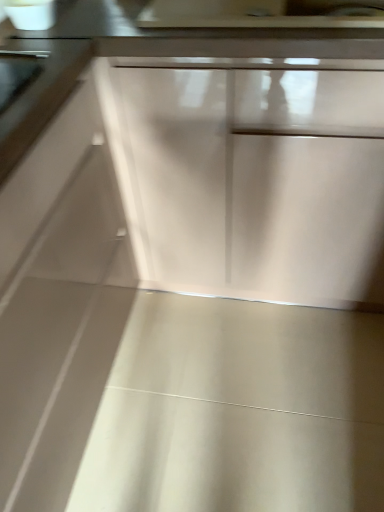
Question: Is satin silver handle at upper left completely or partially outside of matte white drawer at center?

Choices:
 (A) no
 (B) yes

Answer: (B)

Question: Considering the relative sizes of satin silver handle at upper left and matte white drawer at center in the image provided, is satin silver handle at upper left wider than matte white drawer at center?

Choices:
 (A) yes
 (B) no

Answer: (B)

Question: Does satin silver handle at upper left have a greater height compared to matte white drawer at center?

Choices:
 (A) yes
 (B) no

Answer: (B)

Question: Does satin silver handle at upper left touch matte white drawer at center?

Choices:
 (A) yes
 (B) no

Answer: (B)

Question: Is satin silver handle at upper left looking in the opposite direction of matte white drawer at center?

Choices:
 (A) yes
 (B) no

Answer: (B)

Question: Are satin silver handle at upper left and matte white drawer at center located far from each other?

Choices:
 (A) yes
 (B) no

Answer: (B)

Question: Can you confirm if matte white drawer at center is positioned to the left of satin silver handle at upper left?

Choices:
 (A) no
 (B) yes

Answer: (A)

Question: Is there a large distance between matte white drawer at center and satin silver handle at upper left?

Choices:
 (A) yes
 (B) no

Answer: (B)

Question: Can you see matte white drawer at center touching satin silver handle at upper left?

Choices:
 (A) yes
 (B) no

Answer: (B)

Question: Does matte white drawer at center turn towards satin silver handle at upper left?

Choices:
 (A) yes
 (B) no

Answer: (A)

Question: Is matte white drawer at center further to camera compared to satin silver handle at upper left?

Choices:
 (A) no
 (B) yes

Answer: (A)

Question: Can you confirm if matte white drawer at center is shorter than satin silver handle at upper left?

Choices:
 (A) no
 (B) yes

Answer: (A)

Question: Based on their sizes in the image, would you say matte white drawer at center is bigger or smaller than satin silver handle at upper left?

Choices:
 (A) small
 (B) big

Answer: (B)